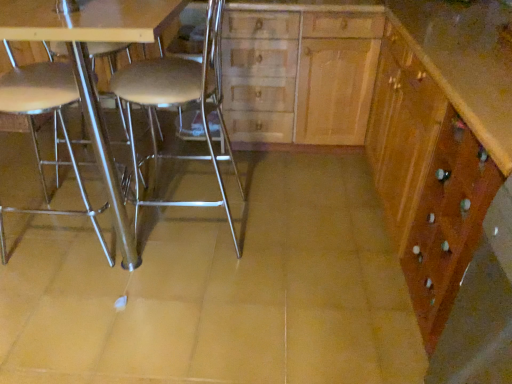
In order to click on vacant area that is in front of metallic silver chair at left, placed as the first chair when sorted from left to right in this screenshot , I will do `click(64, 302)`.